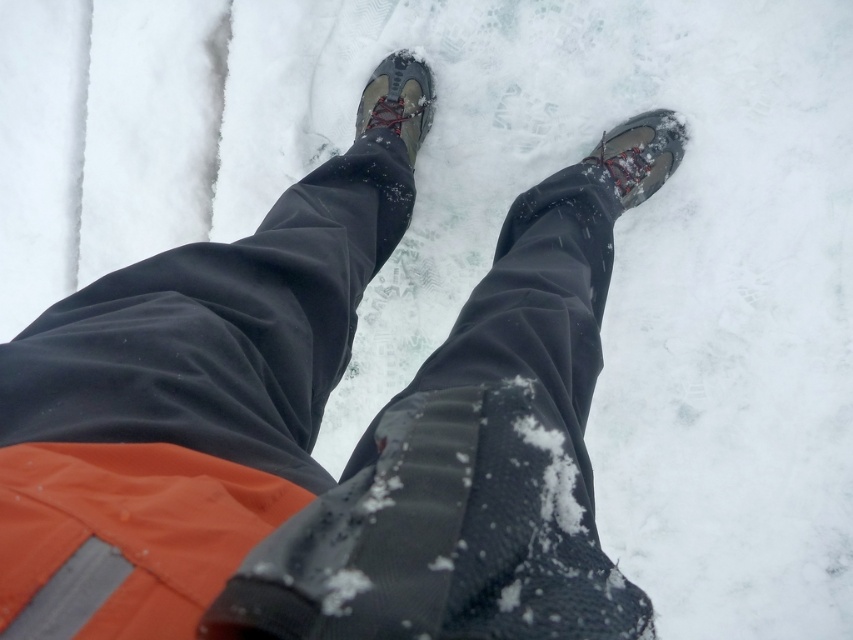
Who is more forward, (x=590, y=157) or (x=370, y=122)?

Positioned in front is point (x=590, y=157).

Does matte gray boot at lower right have a lesser height compared to matte gray boot at center?

Correct, matte gray boot at lower right is not as tall as matte gray boot at center.

Who is more distant from viewer, [643,182] or [412,129]?

Point [412,129]

What are the coordinates of `matte gray boot at lower right` in the screenshot? It's located at (640, 154).